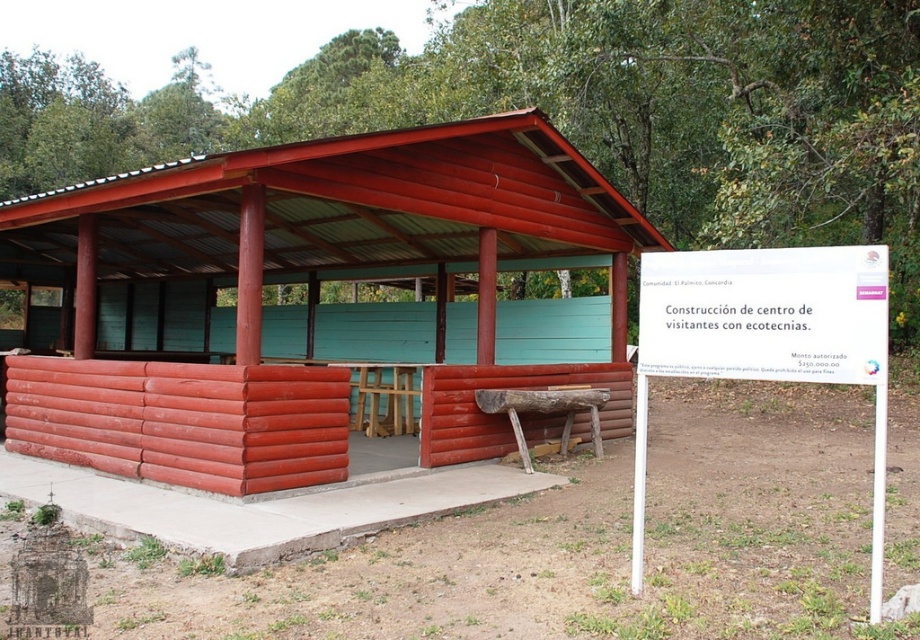
You are standing in front of the matte red log cabin at center and want to read the white plastic sign at center right. Which direction should you turn your head to look at the sign?

You should turn your head to the right to look at the white plastic sign at center right because the matte red log cabin at center is closer to you, so the sign is positioned to the right and slightly behind it.

You are a visitor at this site and want to read the white plastic sign at center right. Is the sign positioned in a way that you can read it while sitting at the wooden picnic table at center?

The white plastic sign at center right is above the wooden picnic table at center, so you can read it while sitting there.

You are a hiker who wants to read the white plastic sign at center right. The matte red log cabin at center is blocking your view. Can you move around the cabin to see the sign better?

The matte red log cabin at center is located above the white plastic sign at center right, so you can move to the side of the cabin to get a better view of the sign.